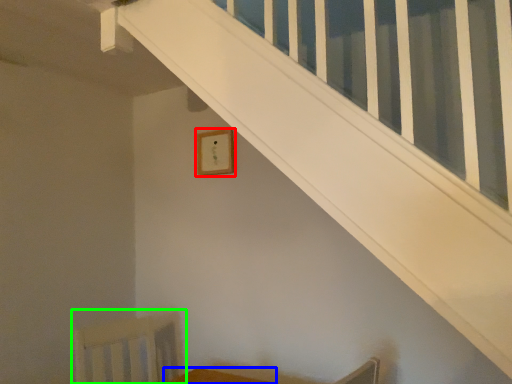
Question: Estimate the real-world distances between objects in this image. Which object is farther from picture frame (highlighted by a red box), furniture (highlighted by a blue box) or swivel chair (highlighted by a green box)?

Choices:
 (A) furniture
 (B) swivel chair

Answer: (A)